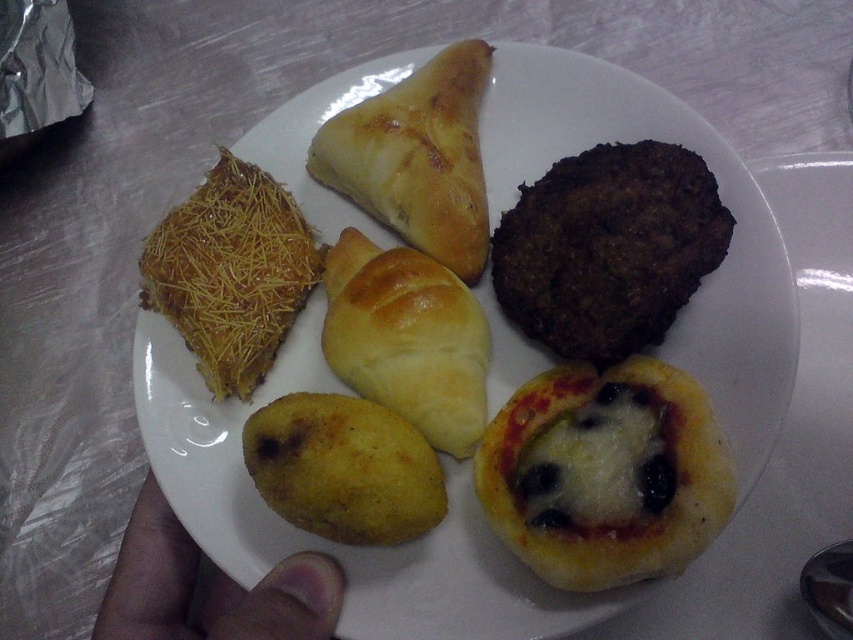
Question: Which point is closer to the camera taking this photo?

Choices:
 (A) (662, 412)
 (B) (195, 330)
 (C) (360, 83)
 (D) (338, 276)

Answer: (A)

Question: Which point appears farthest from the camera in this image?

Choices:
 (A) (436, 296)
 (B) (711, 477)

Answer: (A)

Question: Which object is farther from the camera taking this photo?

Choices:
 (A) golden brown flaky croissant at upper center
 (B) cheesy pizza pocket at center
 (C) brown skin at lower left
 (D) yellow matte potato at center

Answer: (A)

Question: Is golden-brown crusty bread at upper center to the left of golden crispy pastry at upper left from the viewer's perspective?

Choices:
 (A) no
 (B) yes

Answer: (A)

Question: Can you confirm if cheesy pizza pocket at center is wider than yellow matte potato at center?

Choices:
 (A) no
 (B) yes

Answer: (B)

Question: Does golden-brown crusty bread at upper center have a greater width compared to golden crispy pastry at upper left?

Choices:
 (A) no
 (B) yes

Answer: (B)